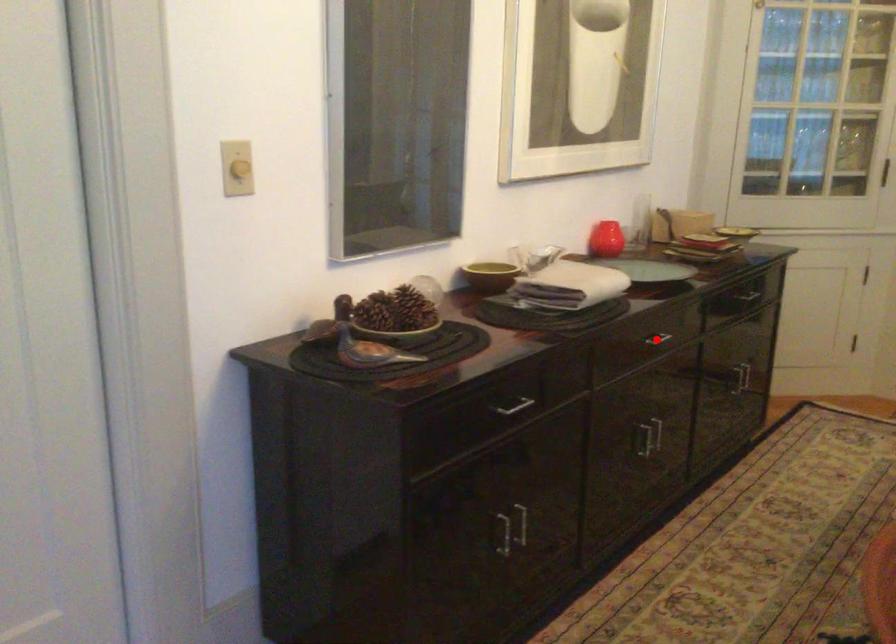
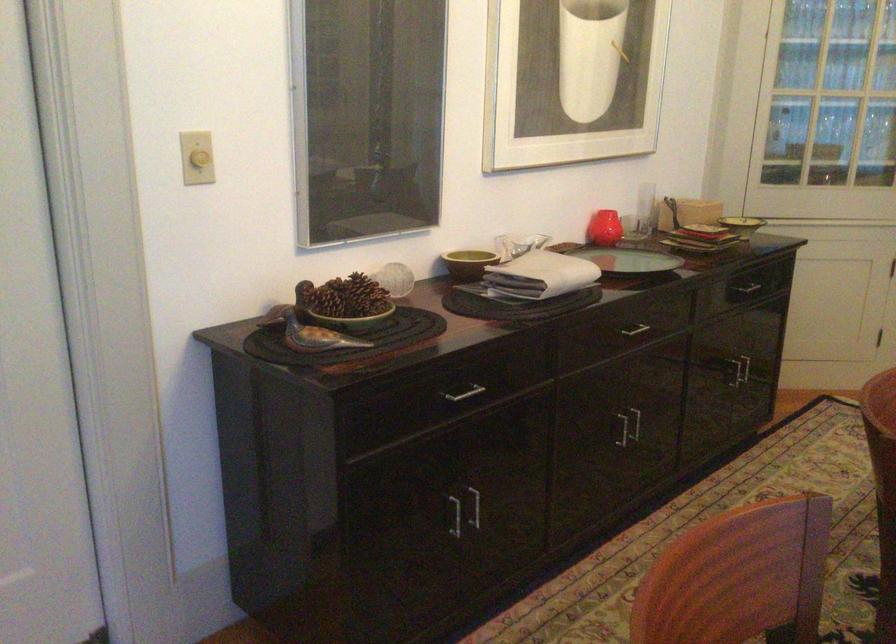
Where in the second image is the point corresponding to the highlighted location from the first image?

(634, 328)